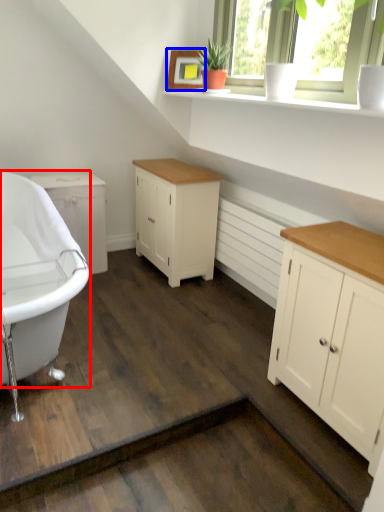
Question: Among these objects, which one is farthest to the camera, bathtub (highlighted by a red box) or picture frame (highlighted by a blue box)?

Choices:
 (A) bathtub
 (B) picture frame

Answer: (B)